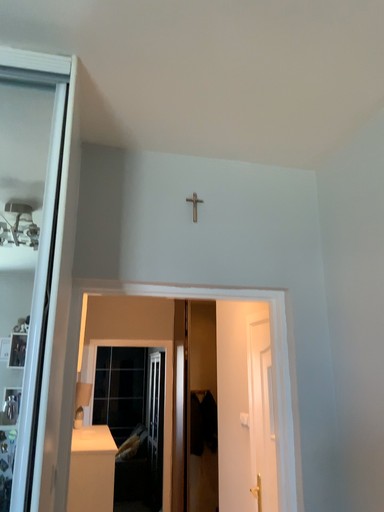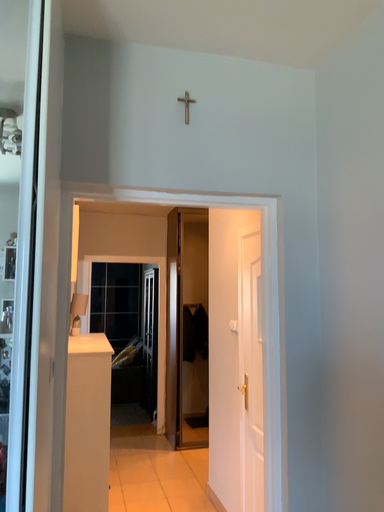
Question: How did the camera likely rotate when shooting the video?

Choices:
 (A) rotated downward
 (B) rotated upward

Answer: (A)